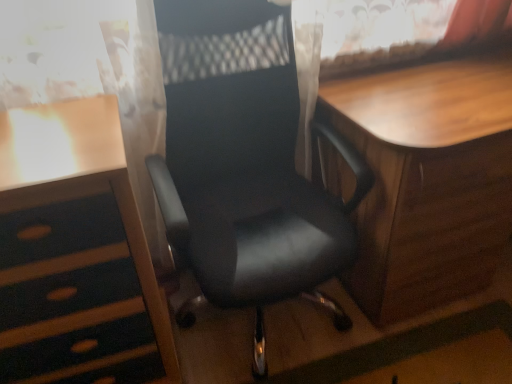
Question: Should I look upward or downward to see black leather chair at center?

Choices:
 (A) up
 (B) down

Answer: (A)

Question: Is black leather chair at center positioned with its back to wooden desk at left?

Choices:
 (A) yes
 (B) no

Answer: (B)

Question: Is black leather chair at center aimed at wooden desk at left?

Choices:
 (A) yes
 (B) no

Answer: (B)

Question: From the image's perspective, does black leather chair at center appear higher than wooden desk at left?

Choices:
 (A) no
 (B) yes

Answer: (B)

Question: Considering the relative sizes of black leather chair at center and wooden desk at left in the image provided, is black leather chair at center shorter than wooden desk at left?

Choices:
 (A) yes
 (B) no

Answer: (B)

Question: Is wooden desk at left located within black leather chair at center?

Choices:
 (A) no
 (B) yes

Answer: (A)

Question: Does black leather chair at center appear on the left side of wooden desk at left?

Choices:
 (A) yes
 (B) no

Answer: (B)

Question: Is black leather chair at center at the back of wooden table at center?

Choices:
 (A) yes
 (B) no

Answer: (B)

Question: Is the depth of wooden table at center less than that of black leather chair at center?

Choices:
 (A) yes
 (B) no

Answer: (B)

Question: From the image's perspective, does wooden table at center appear higher than black leather chair at center?

Choices:
 (A) yes
 (B) no

Answer: (B)

Question: Is wooden table at center bigger than black leather chair at center?

Choices:
 (A) yes
 (B) no

Answer: (A)

Question: Is wooden table at center shorter than black leather chair at center?

Choices:
 (A) no
 (B) yes

Answer: (B)

Question: Could you tell me if wooden table at center is turned towards black leather chair at center?

Choices:
 (A) no
 (B) yes

Answer: (A)

Question: Is wooden desk at left shorter than wooden table at center?

Choices:
 (A) yes
 (B) no

Answer: (B)